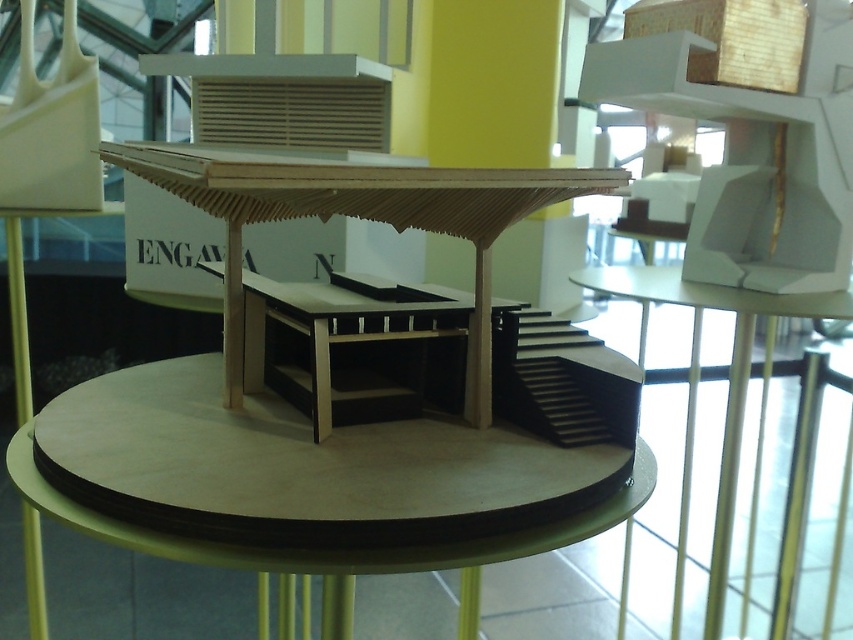
Does wooden at center have a greater width compared to matte wood table at center?

Yes, wooden at center is wider than matte wood table at center.

Is wooden at center bigger than matte wood table at center?

Actually, wooden at center might be smaller than matte wood table at center.

Where is `wooden at center`? Image resolution: width=853 pixels, height=640 pixels. wooden at center is located at coordinates (314, 451).